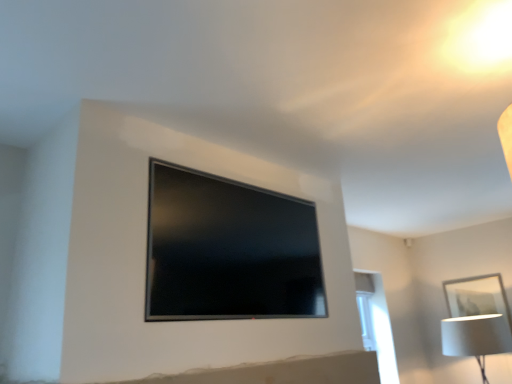
Question: From the image's perspective, is white matte picture frame at lower right above or below white fabric lampshade at lower right?

Choices:
 (A) above
 (B) below

Answer: (A)

Question: Is point (444, 286) closer or farther from the camera than point (458, 339)?

Choices:
 (A) closer
 (B) farther

Answer: (B)

Question: Which object is the closest to the matte black tv at center?

Choices:
 (A) white matte picture frame at lower right
 (B) white fabric lampshade at lower right
 (C) white glossy window at right

Answer: (C)

Question: Based on their relative distances, which object is farther from the white fabric lampshade at lower right?

Choices:
 (A) white matte picture frame at lower right
 (B) white glossy window at right
 (C) matte black tv at center

Answer: (C)